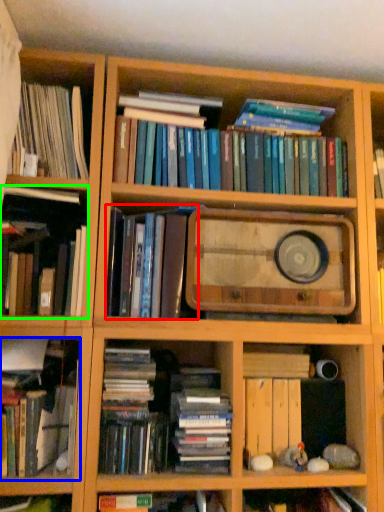
Question: Based on their relative distances, which object is farther from book (highlighted by a red box)? Choose from book (highlighted by a blue box) and book (highlighted by a green box).

Choices:
 (A) book
 (B) book

Answer: (A)